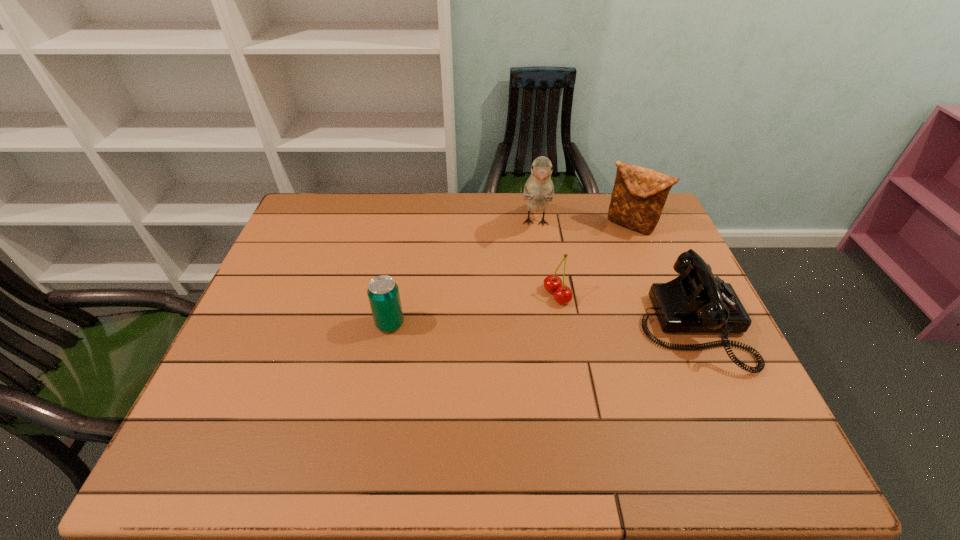
Where is `beer can`? The width and height of the screenshot is (960, 540). beer can is located at coordinates (383, 293).

Find the location of a particular element. The width and height of the screenshot is (960, 540). telephone is located at coordinates (696, 301).

The image size is (960, 540). In order to click on clutch bag in this screenshot , I will do `click(639, 194)`.

You are a GUI agent. You are given a task and a screenshot of the screen. Output one action in this format:
    pyautogui.click(x=<x>, y=<y>)
    Task: Click on the tallest object
    
    Given the screenshot: What is the action you would take?
    pyautogui.click(x=539, y=190)

Image resolution: width=960 pixels, height=540 pixels. What are the coordinates of `cherry` in the screenshot? It's located at (553, 284).

The width and height of the screenshot is (960, 540). In order to click on blank area located 0.170m on the left of the beer can in this screenshot , I will do `click(310, 323)`.

Locate an element on the screen. The height and width of the screenshot is (540, 960). blank area located 0.210m on the open side of the clutch bag is located at coordinates (585, 269).

This screenshot has width=960, height=540. What are the coordinates of `vacant space located 0.170m on the open side of the clutch bag` in the screenshot? It's located at (591, 262).

The height and width of the screenshot is (540, 960). I want to click on blank space located 0.090m on the open side of the clutch bag, so click(604, 249).

You are a GUI agent. You are given a task and a screenshot of the screen. Output one action in this format:
    pyautogui.click(x=<x>, y=<y>)
    Task: Click on the vacant space situated at the face of the tallest object
    The width and height of the screenshot is (960, 540).
    Given the screenshot: What is the action you would take?
    pyautogui.click(x=534, y=327)